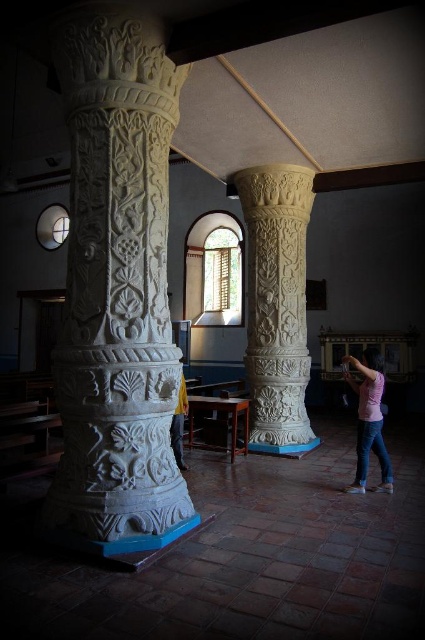
Question: Is pink cotton shirt at lower right further to camera compared to yellow fabric at center?

Choices:
 (A) no
 (B) yes

Answer: (B)

Question: Can you confirm if white stone column at left is wider than pink cotton shirt at lower right?

Choices:
 (A) no
 (B) yes

Answer: (B)

Question: Does white stone column at left have a larger size compared to yellow fabric at center?

Choices:
 (A) yes
 (B) no

Answer: (A)

Question: Which object appears farthest from the camera in this image?

Choices:
 (A) white stone column at left
 (B) pink cotton shirt at lower right
 (C) yellow fabric at center
 (D) white carved column at center

Answer: (D)

Question: Which is nearer to the white stone column at left?

Choices:
 (A) pink cotton shirt at lower right
 (B) white carved column at center
 (C) yellow fabric at center

Answer: (C)

Question: Which point is closer to the camera taking this photo?

Choices:
 (A) (363, 352)
 (B) (184, 410)
 (C) (263, 262)
 (D) (127, 381)

Answer: (D)